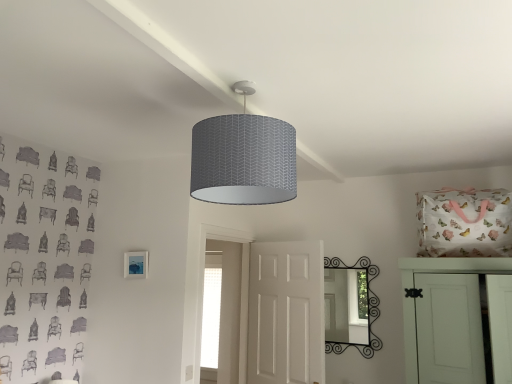
Question: Considering their positions, is white matte door at center, which ranks as the second door in right-to-left order, located in front of or behind black wrought iron mirror at center?

Choices:
 (A) front
 (B) behind

Answer: (A)

Question: From a real-world perspective, is white matte door at center, which ranks as the second door in right-to-left order, positioned above or below black wrought iron mirror at center?

Choices:
 (A) below
 (B) above

Answer: (A)

Question: Which is farther from the white matte cabinet door at right, placed as the second door when sorted from left to right?

Choices:
 (A) gray fabric lampshade at upper center
 (B) black wrought iron mirror at center
 (C) matte blue picture frame at lower left
 (D) white matte door at center, which ranks as the second door in right-to-left order

Answer: (C)

Question: Which object is the farthest from the black wrought iron mirror at center?

Choices:
 (A) white matte door at center, which ranks as the second door in right-to-left order
 (B) white matte cabinet door at right, placed as the second door when sorted from left to right
 (C) gray fabric lampshade at upper center
 (D) matte blue picture frame at lower left

Answer: (C)